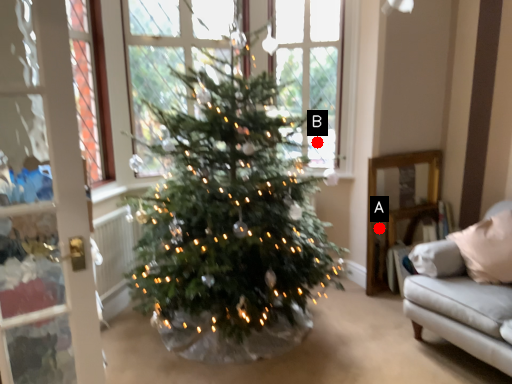
Question: Two points are circled on the image, labeled by A and B beside each circle. Which point is closer to the camera taking this photo?

Choices:
 (A) A is closer
 (B) B is closer

Answer: (A)